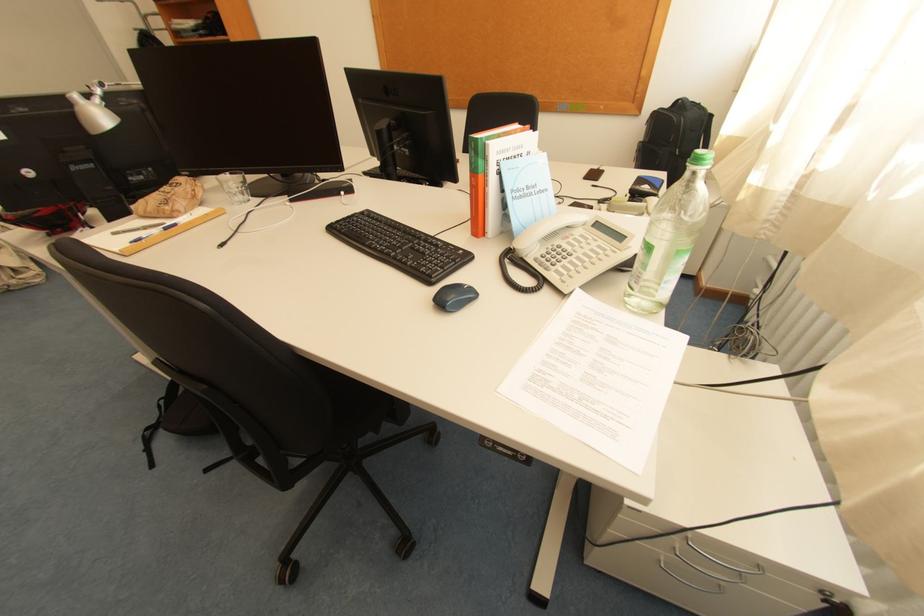
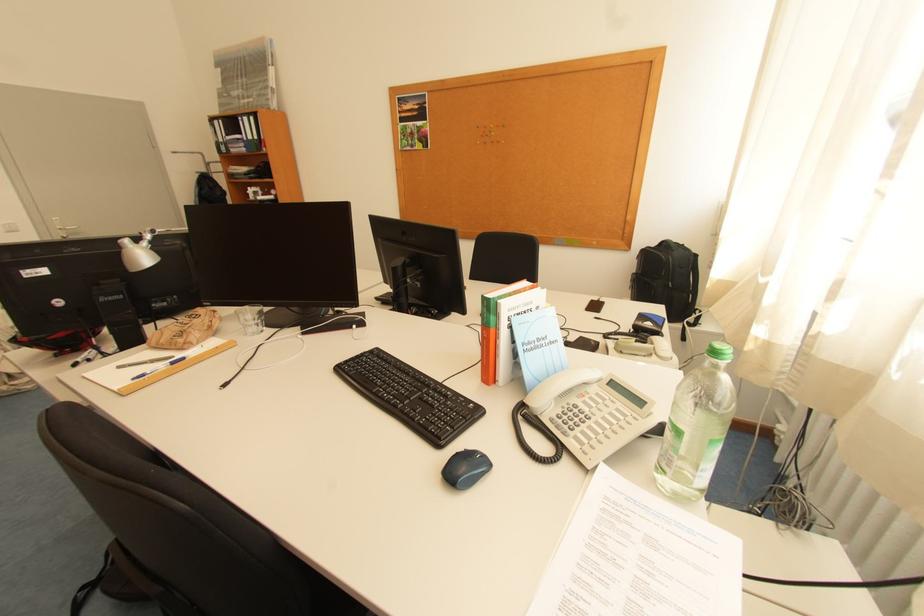
Question: How did the camera likely rotate?

Choices:
 (A) Left
 (B) Right
 (C) Up
 (D) Down

Answer: (C)